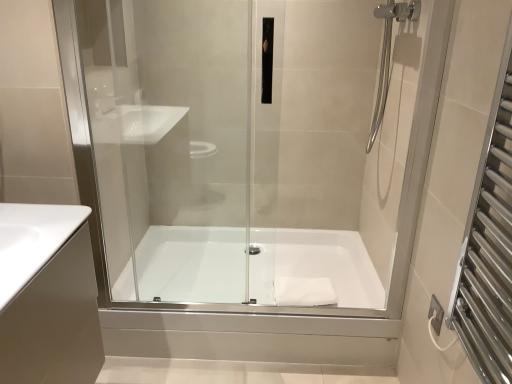
Question: Considering the positions of point (16, 249) and point (501, 77), is point (16, 249) closer or farther from the camera than point (501, 77)?

Choices:
 (A) closer
 (B) farther

Answer: (A)

Question: Is white glossy sink at lower left inside the boundaries of silver metallic towel rack at right, or outside?

Choices:
 (A) inside
 (B) outside

Answer: (B)

Question: Which is nearer to the white glossy bathtub at center?

Choices:
 (A) white glossy sink at lower left
 (B) transparent glass shower door at center
 (C) silver metallic towel rack at right
 (D) white matte towel at center

Answer: (D)

Question: Estimate the real-world distances between objects in this image. Which object is farther from the transparent glass shower door at center?

Choices:
 (A) white glossy bathtub at center
 (B) silver metallic towel rack at right
 (C) white matte towel at center
 (D) white glossy sink at lower left

Answer: (B)